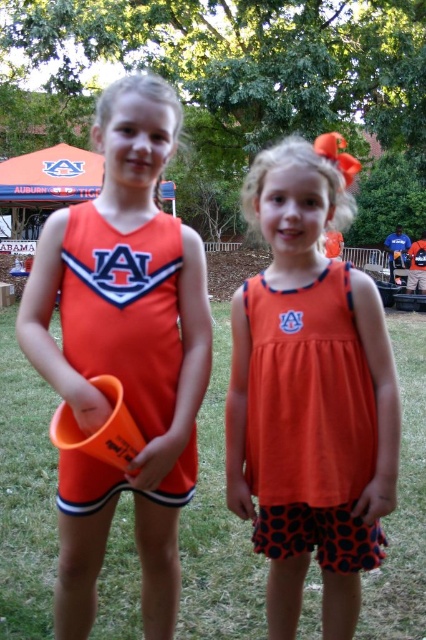
Can you confirm if matte orange cheerleading outfit at center is taller than orange jersey at center?

Correct, matte orange cheerleading outfit at center is much taller as orange jersey at center.

How far apart are matte orange cheerleading outfit at center and orange jersey at center?

They are 3.12 inches apart.

Find the location of a particular element. matte orange cheerleading outfit at center is located at coordinates (123, 349).

What are the coordinates of `matte orange cheerleading outfit at center` in the screenshot? It's located at (123, 349).

Can you confirm if orange fabric dress at center is positioned to the left of orange jersey at center?

Incorrect, orange fabric dress at center is not on the left side of orange jersey at center.

Between point (334, 413) and point (114, 266), which one is positioned in front?

Point (114, 266)

Identify the location of orange fabric dress at center. (310, 390).

Who is more distant from viewer, (106, 472) or (299, 205)?

The point (299, 205) is more distant.

This screenshot has width=426, height=640. What do you see at coordinates (123, 349) in the screenshot?
I see `matte orange cheerleading outfit at center` at bounding box center [123, 349].

The width and height of the screenshot is (426, 640). Identify the location of matte orange cheerleading outfit at center. (123, 349).